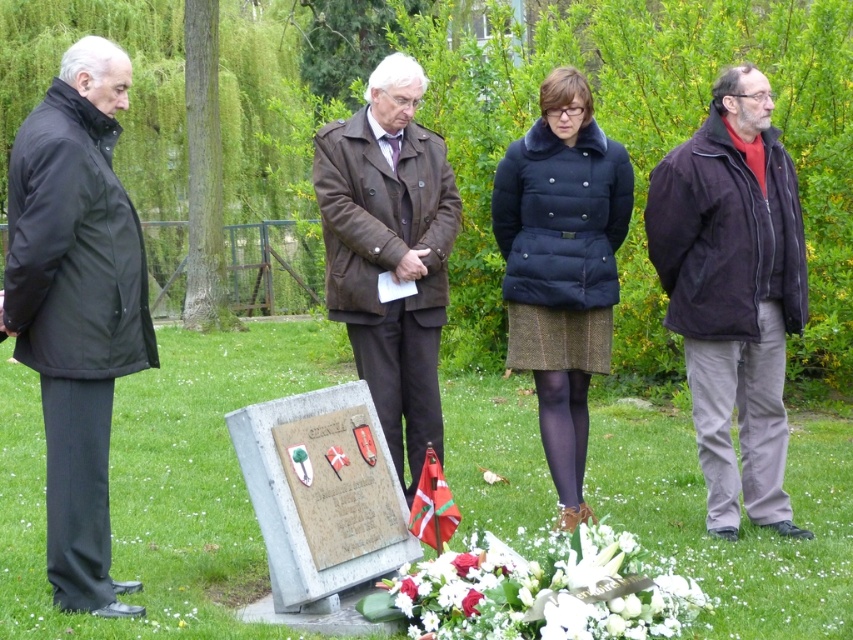
Who is more forward, (80, 538) or (733, 321)?

Point (80, 538) is more forward.

Is point (102, 244) closer to camera compared to point (701, 208)?

Yes, it is in front of point (701, 208).

The image size is (853, 640). Identify the location of black matte jacket at left. (77, 307).

Between black matte jacket at left and brown leather coat at center, which one has more height?

black matte jacket at left is taller.

Is point (109, 196) more distant than point (334, 138)?

No.

Is point (126, 364) farther from viewer compared to point (432, 394)?

No.

You are a GUI agent. You are given a task and a screenshot of the screen. Output one action in this format:
    pyautogui.click(x=<x>, y=<y>)
    Task: Click on the black matte jacket at left
    The width and height of the screenshot is (853, 640).
    Given the screenshot: What is the action you would take?
    pyautogui.click(x=77, y=307)

Between black matte jacket at left and white floral bouquet at lower center, which one has less height?

Standing shorter between the two is white floral bouquet at lower center.

Find the location of a particular element. The height and width of the screenshot is (640, 853). black matte jacket at left is located at coordinates (77, 307).

Between point (103, 243) and point (585, 534), which one is positioned in front?

Point (585, 534) is in front.

Identify the location of black matte jacket at left. pos(77,307).